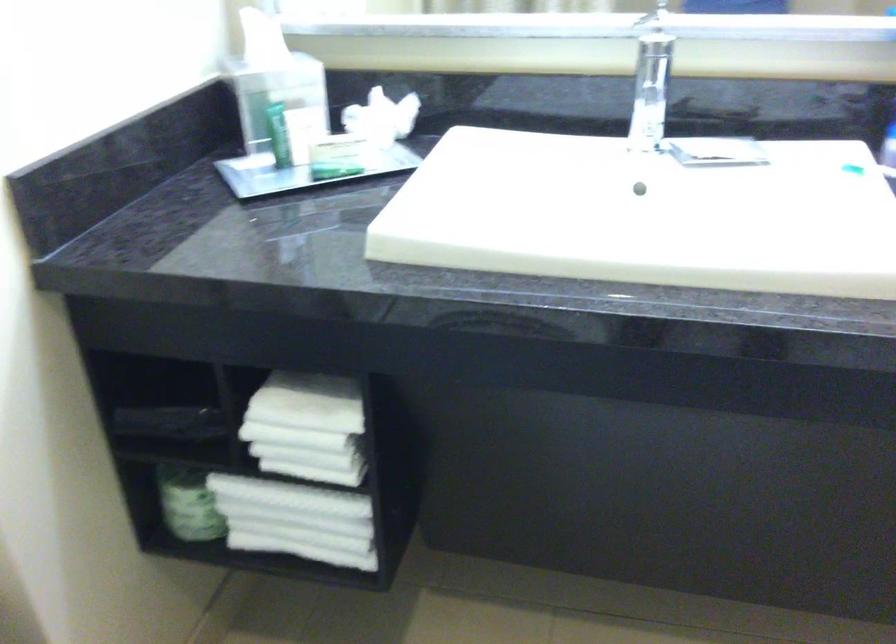
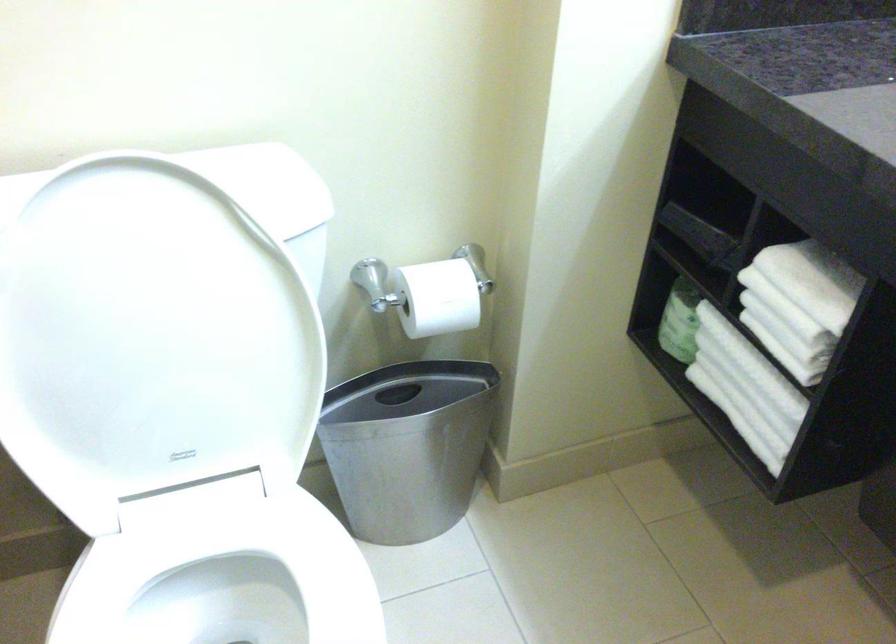
The point at [304,439] is marked in the first image. Where is the corresponding point in the second image?

(785, 308)